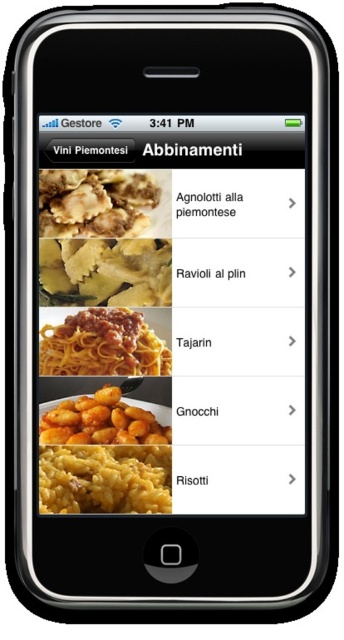
Question: Which of the following is the closest to the observer?

Choices:
 (A) (54, 305)
 (B) (152, 358)
 (C) (155, 467)

Answer: (C)

Question: Does yellow matte pasta at center appear on the right side of brown matte pasta at center?

Choices:
 (A) no
 (B) yes

Answer: (B)

Question: Which object is the farthest from the yellow matte pasta at center?

Choices:
 (A) brown matte ravioli at upper left
 (B) brown matte pasta at center
 (C) yellowish matte gnocchi at bottom

Answer: (C)

Question: From the image, what is the correct spatial relationship of yellowish matte gnocchi at bottom in relation to brown matte pasta at center?

Choices:
 (A) above
 (B) below

Answer: (B)

Question: Among these objects, which one is farthest from the camera?

Choices:
 (A) golden crispy gnocchi at bottom
 (B) brown matte ravioli at upper left

Answer: (B)

Question: Can you confirm if yellow matte pasta at center is positioned above brown matte ravioli at upper left?

Choices:
 (A) no
 (B) yes

Answer: (A)